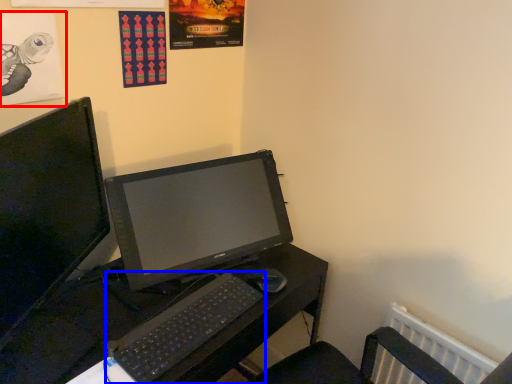
Question: Among these objects, which one is farthest to the camera, poster page (highlighted by a red box) or computer keyboard (highlighted by a blue box)?

Choices:
 (A) poster page
 (B) computer keyboard

Answer: (B)